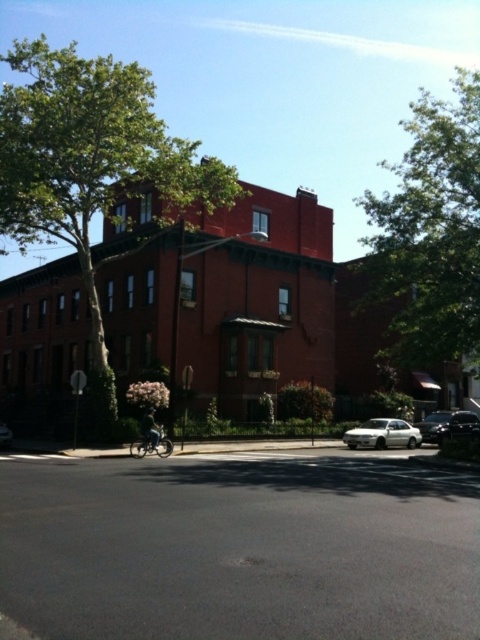
Who is higher up, green leafy tree at upper left or white glossy car at lower center?

green leafy tree at upper left

Between green leafy tree at upper left and white glossy car at lower center, which one appears on the right side from the viewer's perspective?

From the viewer's perspective, white glossy car at lower center appears more on the right side.

This screenshot has height=640, width=480. Identify the location of green leafy tree at upper left. (92, 168).

Locate an element on the screen. The height and width of the screenshot is (640, 480). green leafy tree at upper left is located at coordinates (92, 168).

This screenshot has width=480, height=640. Describe the element at coordinates (450, 426) in the screenshot. I see `shiny black sedan at lower right` at that location.

Can you confirm if shiny black sedan at lower right is positioned to the right of shiny metallic motorcycle at center?

Correct, you'll find shiny black sedan at lower right to the right of shiny metallic motorcycle at center.

Is point (448, 412) closer to viewer compared to point (143, 451)?

No, it is behind (143, 451).

At what (x,y) coordinates should I click in order to perform the action: click on shiny black sedan at lower right. Please return your answer as a coordinate pair (x, y). Looking at the image, I should click on (450, 426).

Is shiny metallic motorcycle at center further to camera compared to white glossy car at lower center?

No, shiny metallic motorcycle at center is closer to the viewer.

Between shiny metallic motorcycle at center and white glossy car at lower center, which one is positioned higher?

shiny metallic motorcycle at center

Is point (136, 456) more distant than point (9, 444)?

No, it is not.

Where is `shiny metallic motorcycle at center`? The width and height of the screenshot is (480, 640). shiny metallic motorcycle at center is located at coordinates (152, 442).